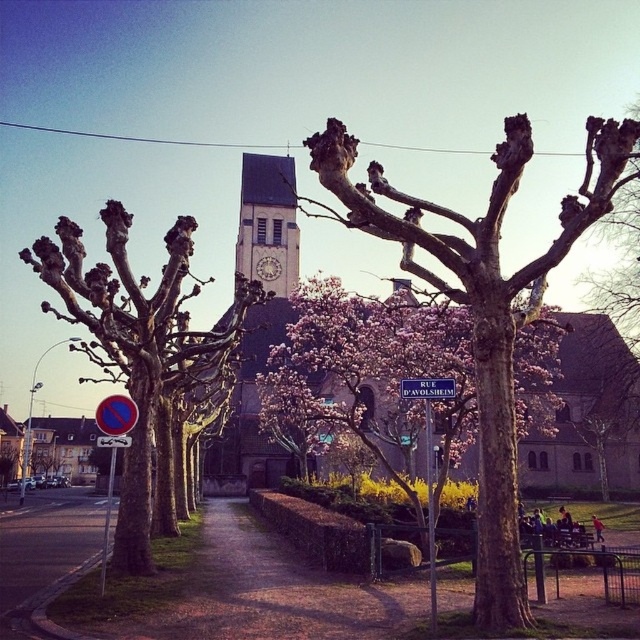
Question: Can you confirm if brown dirt path at center is positioned to the left of blue plastic circle at left?

Choices:
 (A) no
 (B) yes

Answer: (A)

Question: Which of the following is the closest to the observer?

Choices:
 (A) (104, 401)
 (B) (257, 266)

Answer: (A)

Question: Based on their relative distances, which object is nearer to the blue plastic street sign at center?

Choices:
 (A) brown dirt path at center
 (B) blue plastic circle at left
 (C) light beige stone clock tower at center

Answer: (B)

Question: Considering the relative positions of brown dirt path at center and bare bark tree at left in the image provided, where is brown dirt path at center located with respect to bare bark tree at left?

Choices:
 (A) left
 (B) right

Answer: (B)

Question: Can you confirm if bare wood tree at center is bigger than light beige stone clock tower at center?

Choices:
 (A) no
 (B) yes

Answer: (A)

Question: Among these points, which one is nearest to the camera?

Choices:
 (A) (113, 394)
 (B) (445, 387)
 (C) (492, 580)

Answer: (C)